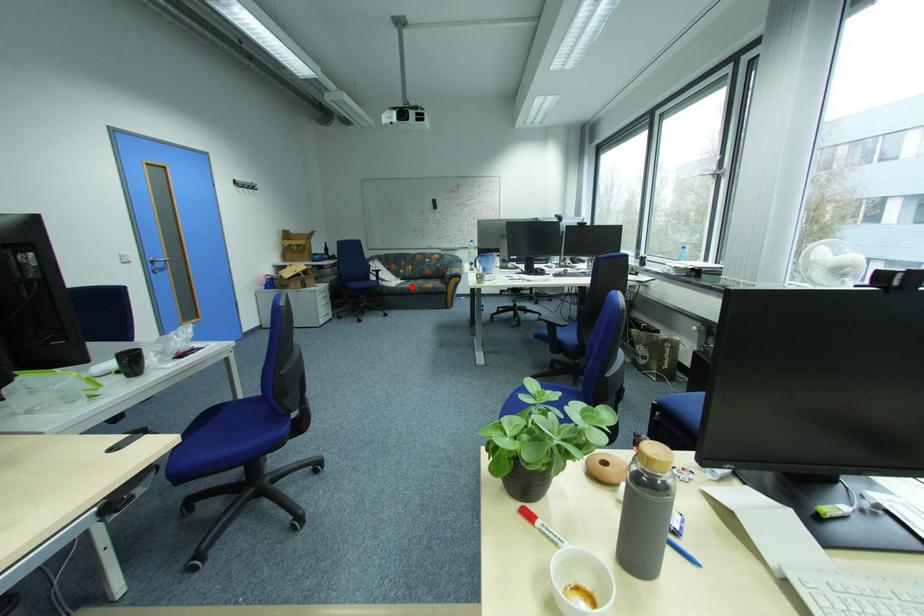
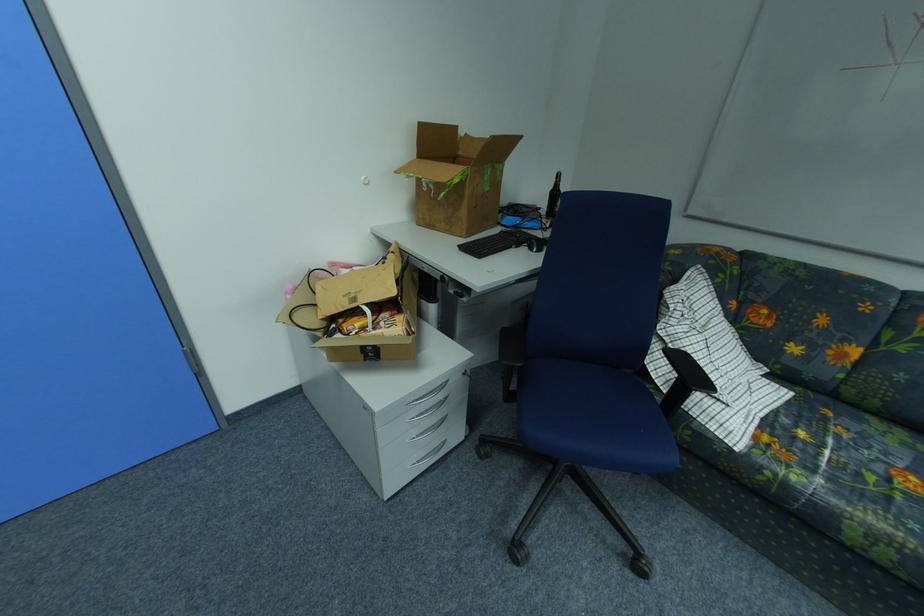
Question: I am providing you with two images of the same scene from different viewpoints. Given a red point in image1, look at the same physical point in image2. Is it:

Choices:
 (A) Closer to the viewpoint
 (B) Farther from the viewpoint

Answer: (B)